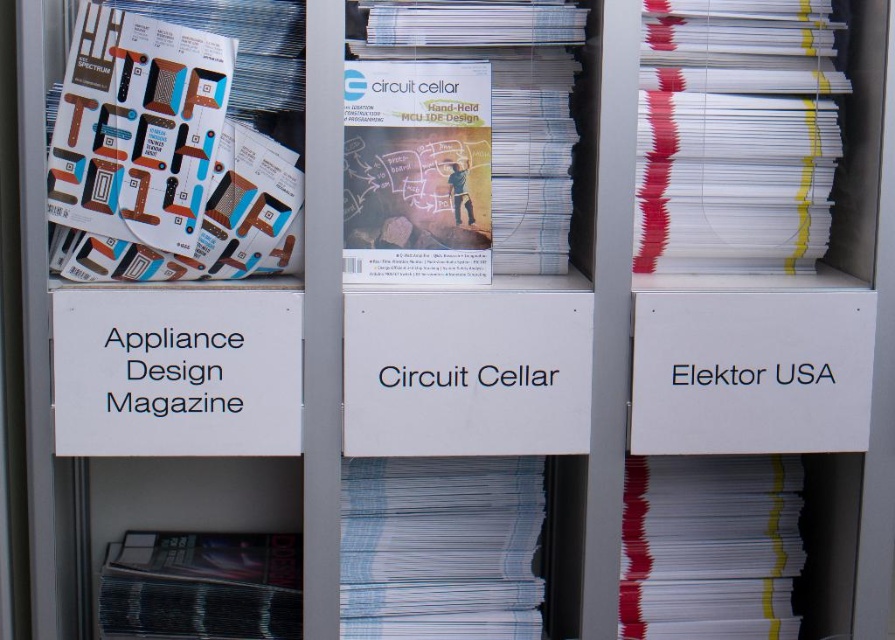
Is point (752, 188) positioned behind point (456, 100)?

That is True.

Can you confirm if white paper stack at right is bigger than matte paper magazine at center?

Yes, white paper stack at right is bigger than matte paper magazine at center.

Which is behind, point (638, 248) or point (391, 188)?

Point (638, 248)

Locate an element on the screen. Image resolution: width=895 pixels, height=640 pixels. white paper stack at right is located at coordinates (736, 134).

Looking at this image, which is below, white paper at center or matte paper magazine at center?

Positioned lower is white paper at center.

Does white paper at center have a smaller size compared to matte paper magazine at center?

Actually, white paper at center might be larger than matte paper magazine at center.

Which is behind, point (540, 461) or point (378, 145)?

Point (540, 461)

You are a GUI agent. You are given a task and a screenshot of the screen. Output one action in this format:
    pyautogui.click(x=<x>, y=<y>)
    Task: Click on the white paper at center
    
    Given the screenshot: What is the action you would take?
    pyautogui.click(x=441, y=547)

Who is positioned more to the right, white paper stack at right or matte black magazine at lower left?

From the viewer's perspective, white paper stack at right appears more on the right side.

Is white paper stack at right bigger than matte black magazine at lower left?

Yes.

Does point (757, 260) come farther from viewer compared to point (192, 557)?

No, it is not.

You are a GUI agent. You are given a task and a screenshot of the screen. Output one action in this format:
    pyautogui.click(x=<x>, y=<y>)
    Task: Click on the white paper stack at right
    This screenshot has width=895, height=640.
    Given the screenshot: What is the action you would take?
    pyautogui.click(x=736, y=134)